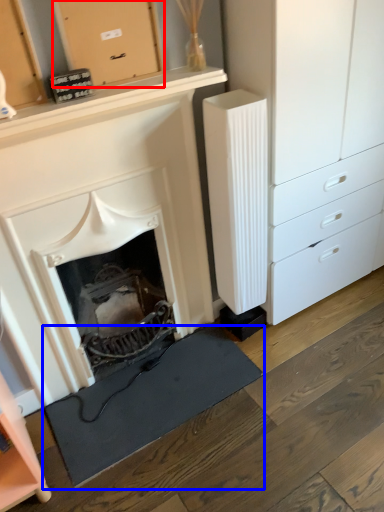
Question: Which object appears farthest to the camera in this image, cabinetry (highlighted by a red box) or doormat (highlighted by a blue box)?

Choices:
 (A) cabinetry
 (B) doormat

Answer: (B)